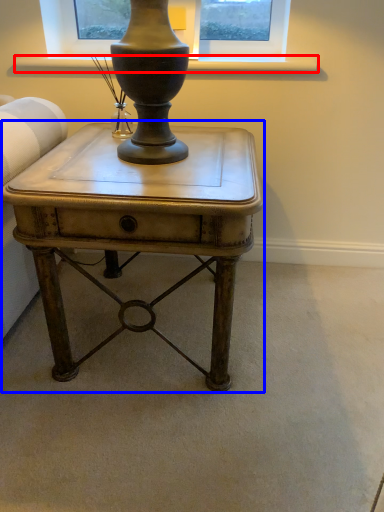
Question: Which object is closer to the camera taking this photo, window sill (highlighted by a red box) or table (highlighted by a blue box)?

Choices:
 (A) window sill
 (B) table

Answer: (B)